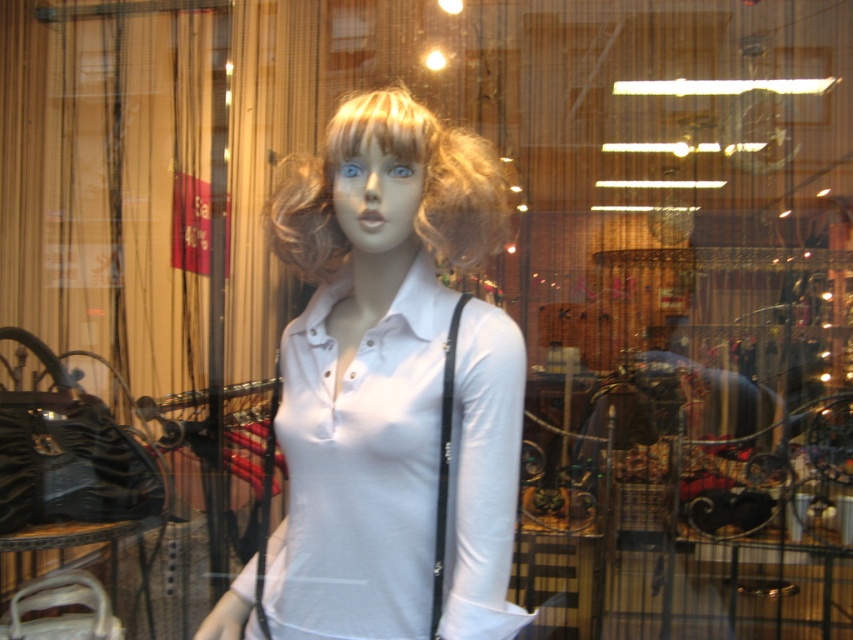
Is point (503, 628) more distant than point (451, 205)?

No, (503, 628) is in front of (451, 205).

Does white matte shirt at center come in front of blondehair at center?

Yes.

Which is behind, point (505, 353) or point (463, 224)?

Point (463, 224)

Identify the location of white matte shirt at center. Image resolution: width=853 pixels, height=640 pixels. (393, 387).